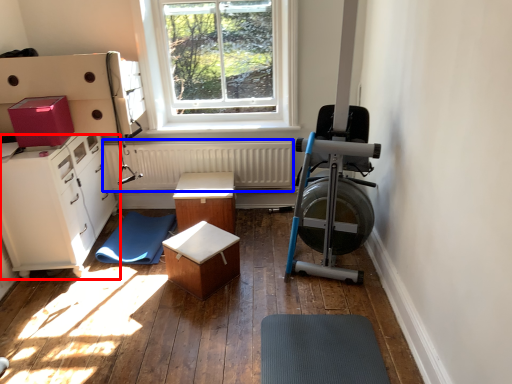
Question: Which of the following is the farthest to the observer, cabinetry (highlighted by a red box) or radiator (highlighted by a blue box)?

Choices:
 (A) cabinetry
 (B) radiator

Answer: (B)